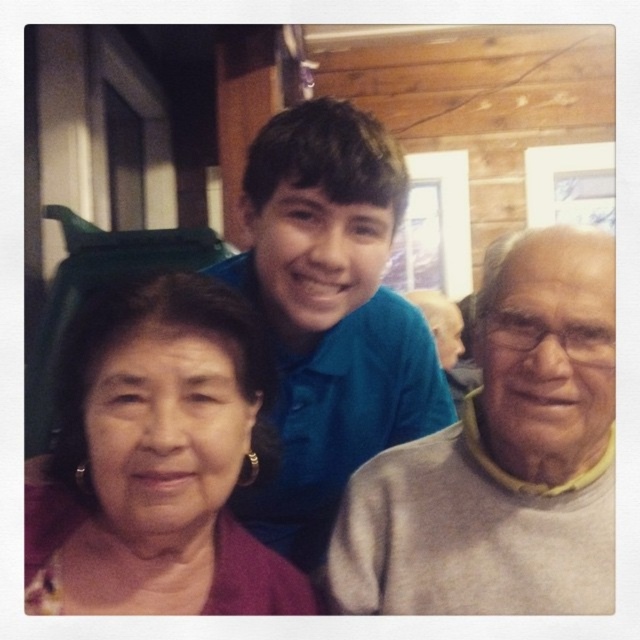
Question: Based on their relative distances, which object is nearer to the blue cotton shirt at center?

Choices:
 (A) gray/yellow sweater at right
 (B) purple fabric at left

Answer: (B)

Question: Is gray/yellow sweater at right closer to the viewer compared to purple fabric at left?

Choices:
 (A) no
 (B) yes

Answer: (A)

Question: Does purple fabric at left appear on the right side of blue cotton shirt at center?

Choices:
 (A) yes
 (B) no

Answer: (B)

Question: Observing the image, what is the correct spatial positioning of purple fabric at left in reference to blue cotton shirt at center?

Choices:
 (A) below
 (B) above

Answer: (A)

Question: Considering the real-world distances, which object is farthest from the blue cotton shirt at center?

Choices:
 (A) purple fabric at left
 (B) gray/yellow sweater at right

Answer: (B)

Question: Among these points, which one is farthest from the camera?

Choices:
 (A) (376, 384)
 (B) (368, 464)
 (C) (243, 541)

Answer: (A)